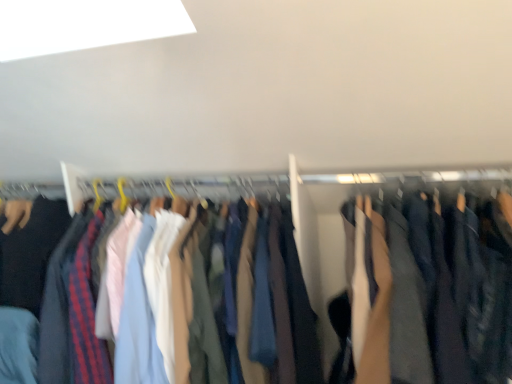
Question: Does dark blue cotton pants at center come in front of dark gray fabric pants at right?

Choices:
 (A) no
 (B) yes

Answer: (A)

Question: Does dark blue cotton pants at center have a smaller size compared to dark gray fabric pants at right?

Choices:
 (A) yes
 (B) no

Answer: (B)

Question: Is dark blue cotton pants at center far away from dark gray fabric pants at right?

Choices:
 (A) no
 (B) yes

Answer: (A)

Question: Can you confirm if dark blue cotton pants at center is taller than dark gray fabric pants at right?

Choices:
 (A) yes
 (B) no

Answer: (A)

Question: Is the depth of dark blue cotton pants at center greater than that of dark gray fabric pants at right?

Choices:
 (A) yes
 (B) no

Answer: (A)

Question: From the image's perspective, is dark blue cotton pants at center located beneath dark gray fabric pants at right?

Choices:
 (A) yes
 (B) no

Answer: (A)

Question: Can you confirm if dark gray fabric pants at right is positioned to the left of dark blue cotton pants at center?

Choices:
 (A) yes
 (B) no

Answer: (B)

Question: Does dark gray fabric pants at right have a lesser height compared to dark blue cotton pants at center?

Choices:
 (A) no
 (B) yes

Answer: (B)

Question: Can you confirm if dark gray fabric pants at right is bigger than dark blue cotton pants at center?

Choices:
 (A) yes
 (B) no

Answer: (B)

Question: Considering the relative sizes of dark gray fabric pants at right and dark blue cotton pants at center in the image provided, is dark gray fabric pants at right wider than dark blue cotton pants at center?

Choices:
 (A) yes
 (B) no

Answer: (A)

Question: Is dark gray fabric pants at right not close to dark blue cotton pants at center?

Choices:
 (A) yes
 (B) no

Answer: (B)

Question: Does dark gray fabric pants at right have a smaller size compared to dark blue cotton pants at center?

Choices:
 (A) yes
 (B) no

Answer: (A)

Question: Considering the positions of dark gray fabric pants at right and dark blue cotton pants at center in the image, is dark gray fabric pants at right wider or thinner than dark blue cotton pants at center?

Choices:
 (A) thin
 (B) wide

Answer: (B)